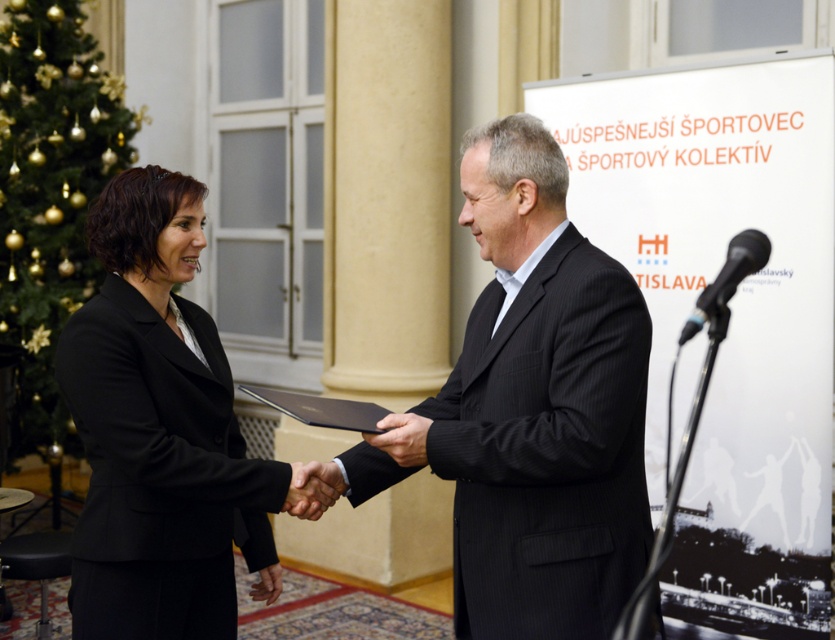
You are an event photographer who needs to capture a closeup of the black leather hand at center. Based on the scene description, where exactly should you focus your camera?

The black leather hand at center is located at point (312,488), so you should focus your camera there.